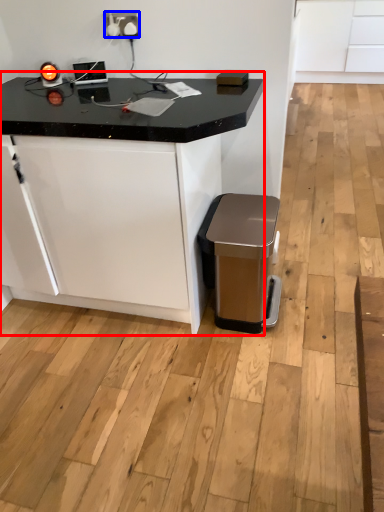
Question: Which object appears farthest to the camera in this image, table (highlighted by a red box) or electric outlet (highlighted by a blue box)?

Choices:
 (A) table
 (B) electric outlet

Answer: (B)